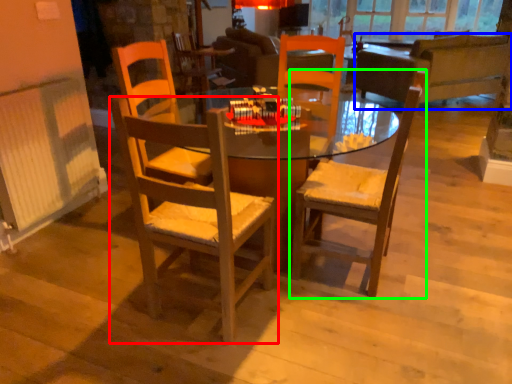
Question: Which is farther away from chair (highlighted by a red box)? studio couch (highlighted by a blue box) or chair (highlighted by a green box)?

Choices:
 (A) studio couch
 (B) chair

Answer: (A)